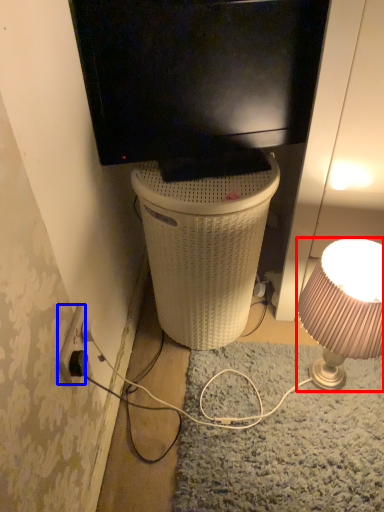
Question: Which object appears closest to the camera in this image, lamp (highlighted by a red box) or power outlet (highlighted by a blue box)?

Choices:
 (A) lamp
 (B) power outlet

Answer: (B)